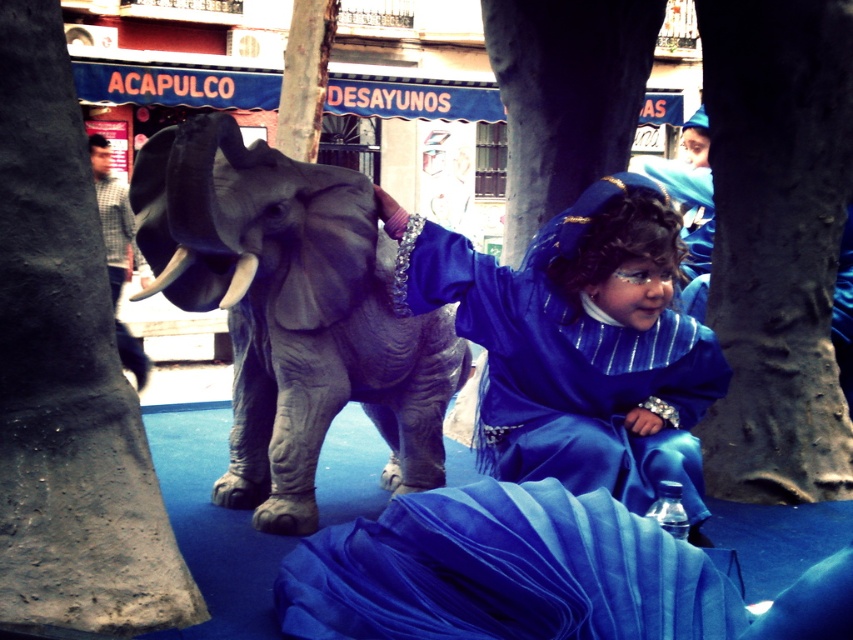
You are a photographer trying to capture a photo of the gray matte elephant at center and the smooth gray tree trunk at left. If you want to frame them both in the same shot, which object should you position closer to the edge of the frame?

The smooth gray tree trunk at left is positioned on the left side of the gray matte elephant at center, so to frame both in the same shot, you should position the smooth gray tree trunk at left closer to the left edge of the frame.

You are a park ranger who needs to place a 10 feet long safety barrier between the smooth gray tree trunk at left and the smooth gray tree trunk at center. Can you fit the barrier between them?

The distance between the smooth gray tree trunk at left and the smooth gray tree trunk at center is 15.80 feet, so yes, the 10 feet long safety barrier can be placed between them since it is shorter than the available space.

You are a photographer setting up for a cultural event. You need to position a camera to capture both the smooth gray tree trunk at left and the gray matte elephant at center in the same frame. Based on their positions, which object should you focus on first to ensure both are in the shot?

The smooth gray tree trunk at left is located below the gray matte elephant at center, so you should focus on the gray matte elephant at center first to ensure both are in the frame.